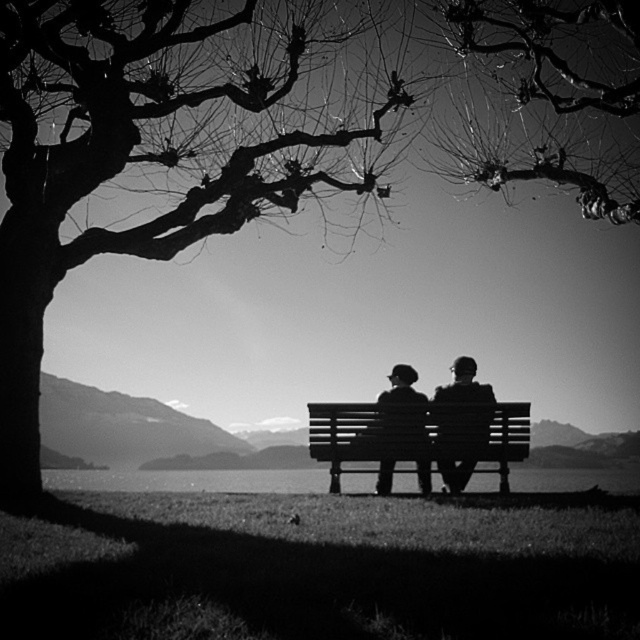
Question: Is smooth bark tree at upper center to the right of silhouette wooden bench at center from the viewer's perspective?

Choices:
 (A) no
 (B) yes

Answer: (B)

Question: Does smooth bark tree at upper center have a lesser width compared to transparent water at bench center?

Choices:
 (A) yes
 (B) no

Answer: (A)

Question: From the image, what is the correct spatial relationship of silhouette wooden bench at center in relation to smooth wooden bench at center?

Choices:
 (A) above
 (B) below

Answer: (A)

Question: Which of the following is the closest to the observer?

Choices:
 (A) smooth black jacket at center
 (B) wooden bench at center
 (C) silhouette wooden bench at center
 (D) smooth wooden bench at center

Answer: (B)

Question: Which object is the farthest from the smooth bark tree at upper center?

Choices:
 (A) silhouette bark tree at left
 (B) wooden bench at center
 (C) transparent water at bench center
 (D) silhouette wooden bench at center

Answer: (A)

Question: Which point is farther from the camera taking this photo?

Choices:
 (A) (458, 438)
 (B) (433, 394)
 (C) (106, 92)
 (D) (440, 387)

Answer: (B)